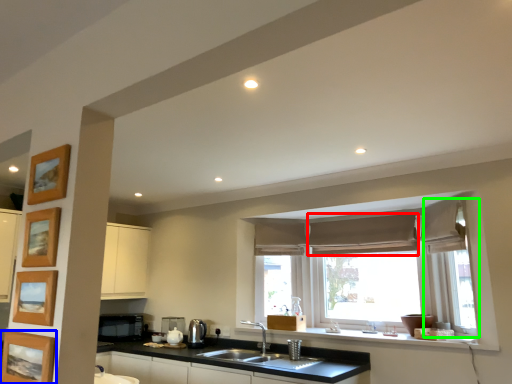
Question: Estimate the real-world distances between objects in this image. Which object is farther from curtain (highlighted by a red box), picture frame (highlighted by a blue box) or window frame (highlighted by a green box)?

Choices:
 (A) picture frame
 (B) window frame

Answer: (A)